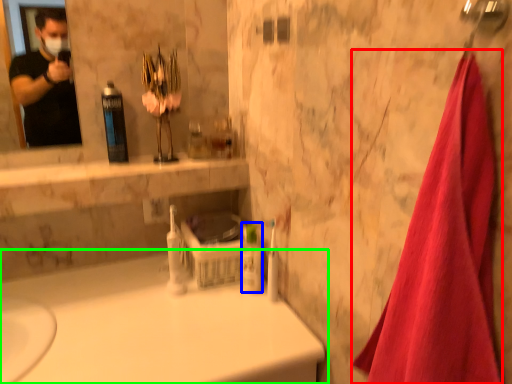
Question: Based on their relative distances, which object is nearer to bath towel (highlighted by a red box)? Choose from mouthwash (highlighted by a blue box) and bathtub (highlighted by a green box).

Choices:
 (A) mouthwash
 (B) bathtub

Answer: (B)